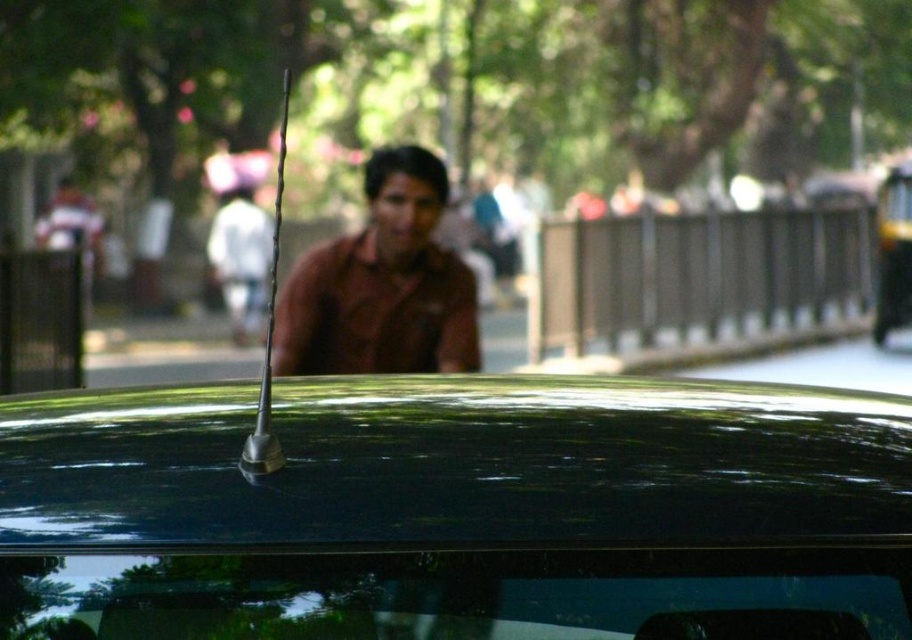
Question: Can you confirm if glossy metallic antenna at center is wider than brown matte shirt at center?

Choices:
 (A) no
 (B) yes

Answer: (B)

Question: Which of the following is the farthest from the observer?

Choices:
 (A) brown matte shirt at center
 (B) glossy metallic antenna at center

Answer: (A)

Question: Is glossy metallic antenna at center positioned behind brown matte shirt at center?

Choices:
 (A) yes
 (B) no

Answer: (B)

Question: Is glossy metallic antenna at center thinner than brown matte shirt at center?

Choices:
 (A) no
 (B) yes

Answer: (A)